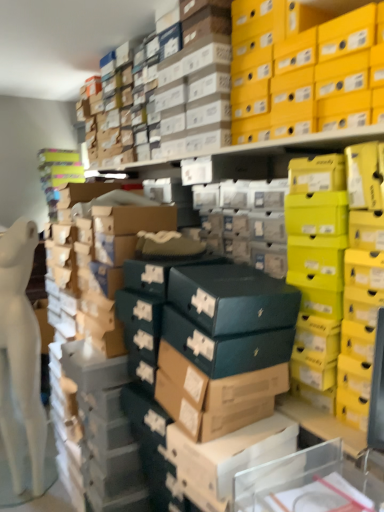
Question: In the image, is yellow matte shoebox at upper right on the left side or the right side of brown cardboard box at center?

Choices:
 (A) right
 (B) left

Answer: (A)

Question: Considering their positions, is yellow matte shoebox at upper right located in front of or behind brown cardboard box at center?

Choices:
 (A) front
 (B) behind

Answer: (B)

Question: Looking at the image, does yellow matte shoebox at upper right seem bigger or smaller compared to brown cardboard box at center?

Choices:
 (A) big
 (B) small

Answer: (A)

Question: Is brown cardboard box at center in front of or behind yellow matte shoebox at upper right in the image?

Choices:
 (A) front
 (B) behind

Answer: (A)

Question: In terms of height, does brown cardboard box at center look taller or shorter compared to yellow matte shoebox at upper right?

Choices:
 (A) tall
 (B) short

Answer: (A)

Question: From the image's perspective, is brown cardboard box at center positioned above or below yellow matte shoebox at upper right?

Choices:
 (A) below
 (B) above

Answer: (A)

Question: Is point (284, 445) closer or farther from the camera than point (324, 27)?

Choices:
 (A) closer
 (B) farther

Answer: (A)